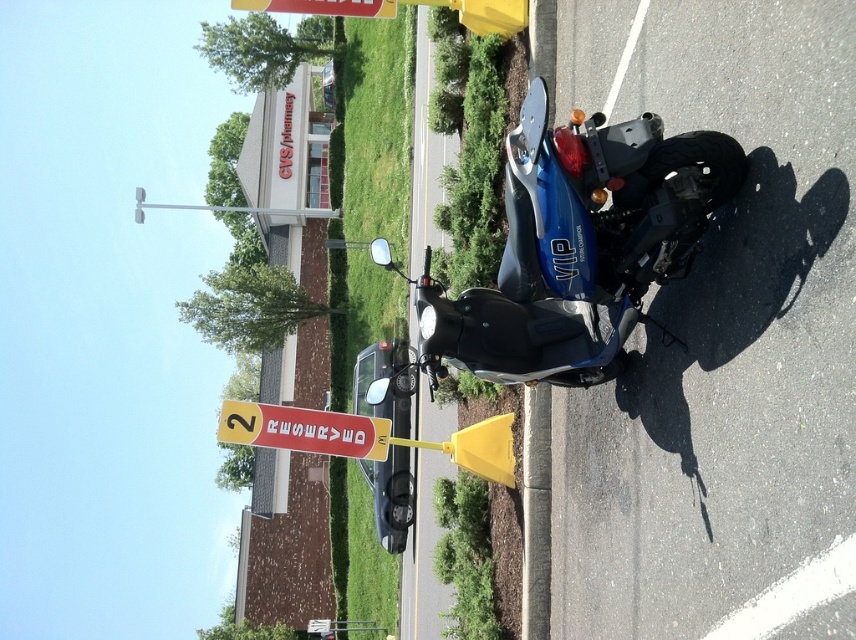
You are a delivery person who needs to load a package onto the blue glossy scooter at center and the red plastic sign at lower center. Which object is taller and can hold the package more securely?

The blue glossy scooter at center is much taller than the red plastic sign at lower center, so the blue glossy scooter at center can hold the package more securely.

You are a delivery driver who needs to park your scooter near the CVS store. You see the blue glossy scooter at center and the red plastic sign at lower center. According to the parking rules, scooters must be parked above reserved signs. Can you park your scooter in this spot?

The blue glossy scooter at center is located above the red plastic sign at lower center, which meets the parking rule requirement. Therefore, you can park your scooter in this spot.

From the picture: You are a delivery person who needs to park a scooter that is 1.2 meters wide. The blue glossy scooter at center is already parked in the reserved spot. Can your scooter fit in the same parking area if the red plastic sign at lower center is moved aside?

The blue glossy scooter at center is wider than the red plastic sign at lower center. Since your scooter is 1.2 meters wide and the parking area must accommodate the width of the scooter, you need to compare the scooter width with the available space. However, the exact width of the parking area isn not provided. But since the existing scooter is wider than the sign, and assuming the sign was the narrower part, moving it might allow space for your scooter if the total area is sufficient. Without specific 1